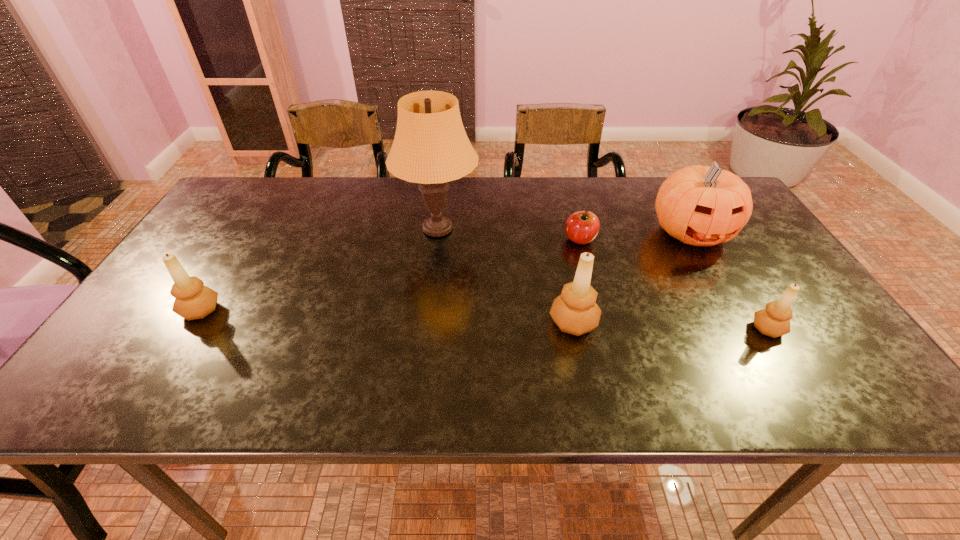
Find the location of a particular element. vacant position located 0.230m on the back of the tallest candle_holder is located at coordinates (558, 244).

This screenshot has height=540, width=960. I want to click on free space located on the back of the shortest candle_holder, so [737, 280].

The image size is (960, 540). I want to click on free space located 0.110m on the front-facing side of the pumpkin, so click(723, 288).

Locate an element on the screen. vacant space positioned on the right of the tallest object is located at coordinates (559, 230).

Find the location of a particular element. This screenshot has height=540, width=960. free space located on the left of the shortest object is located at coordinates (495, 239).

I want to click on pumpkin located at the far edge, so click(x=699, y=205).

The image size is (960, 540). In order to click on lampshade at the far edge in this screenshot , I will do `click(430, 147)`.

Locate an element on the screen. object positioned at the left edge is located at coordinates (193, 300).

Locate an element on the screen. This screenshot has height=540, width=960. candle_holder at the right edge is located at coordinates (774, 321).

Identify the location of pumpkin that is at the right edge. (699, 205).